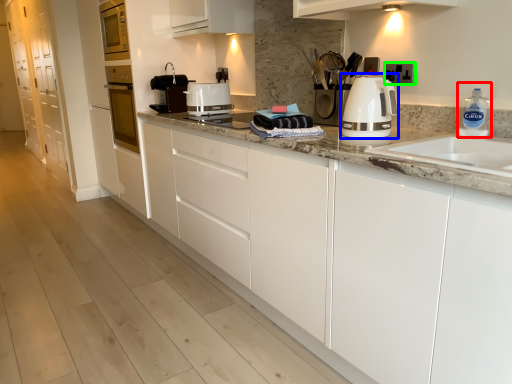
Question: Considering the real-world distances, which object is closest to cleaning product (highlighted by a red box)? home appliance (highlighted by a blue box) or electric outlet (highlighted by a green box).

Choices:
 (A) home appliance
 (B) electric outlet

Answer: (B)